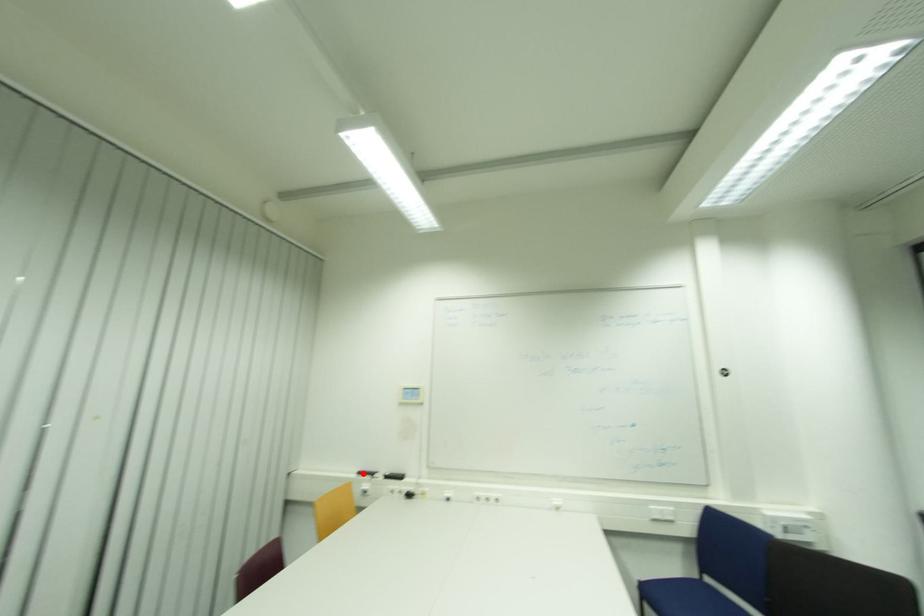
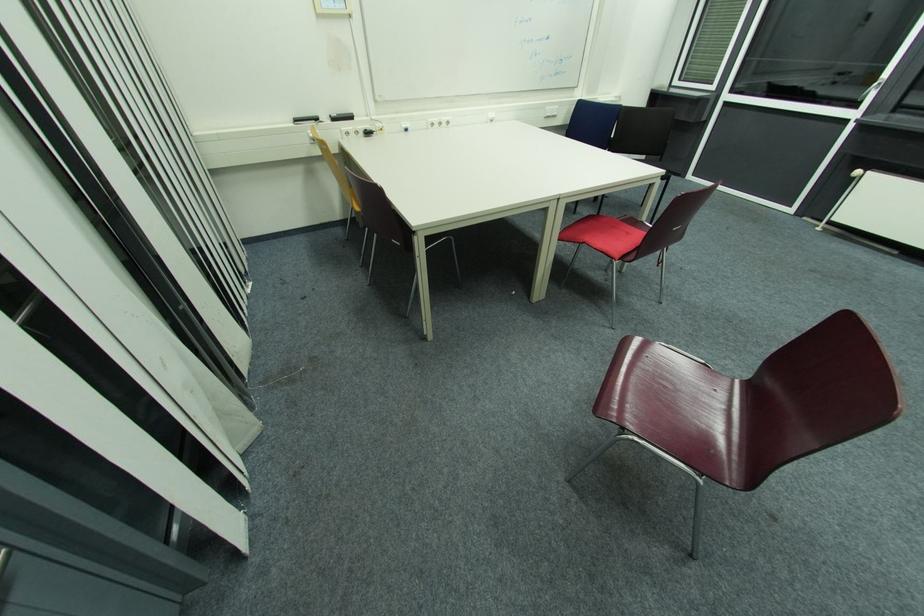
The point at the highlighted location is marked in the first image. Where is the corresponding point in the second image?

(300, 121)